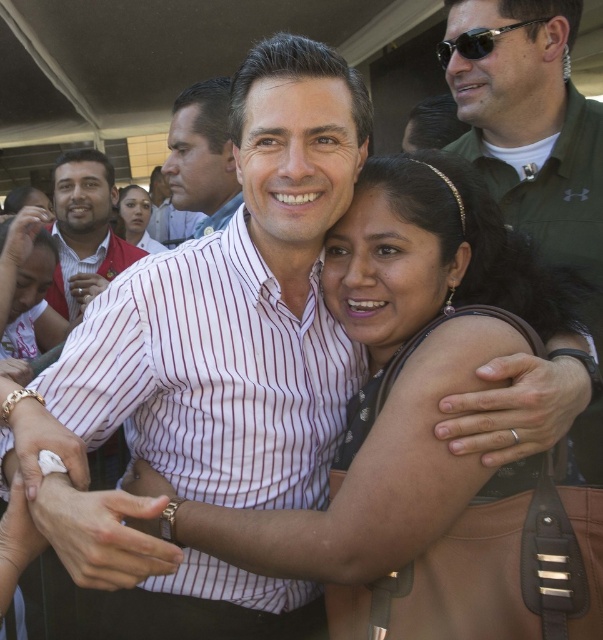
Question: Which point is farther to the camera?

Choices:
 (A) matte red shirt at left
 (B) sunglasses at upper right
 (C) matte black hair at upper center

Answer: (C)

Question: Is matte red shirt at left bigger than matte black hair at upper center?

Choices:
 (A) no
 (B) yes

Answer: (A)

Question: Does green fabric shirt at upper right have a larger size compared to sunglasses at upper right?

Choices:
 (A) no
 (B) yes

Answer: (B)

Question: Which object appears farthest from the camera in this image?

Choices:
 (A) striped shirt at center
 (B) matte white shirt at center
 (C) green fabric shirt at upper right
 (D) sunglasses at upper right

Answer: (B)

Question: Which of the following is the farthest from the observer?

Choices:
 (A) matte white shirt at center
 (B) striped shirt at center
 (C) green fabric shirt at upper right
 (D) sunglasses at upper right

Answer: (A)

Question: Can you confirm if striped shirt at center is thinner than matte black hair at upper center?

Choices:
 (A) no
 (B) yes

Answer: (B)